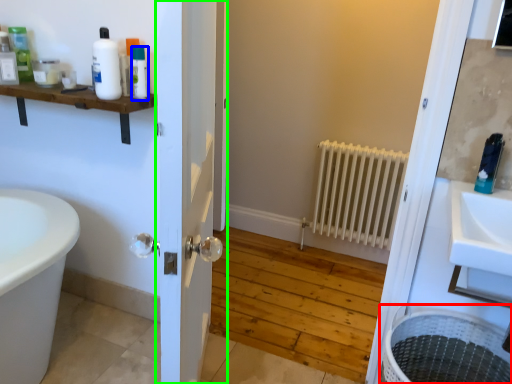
Question: Based on their relative distances, which object is nearer to laundry basket (highlighted by a red box)? Choose from toiletry (highlighted by a blue box) and door (highlighted by a green box).

Choices:
 (A) toiletry
 (B) door

Answer: (B)